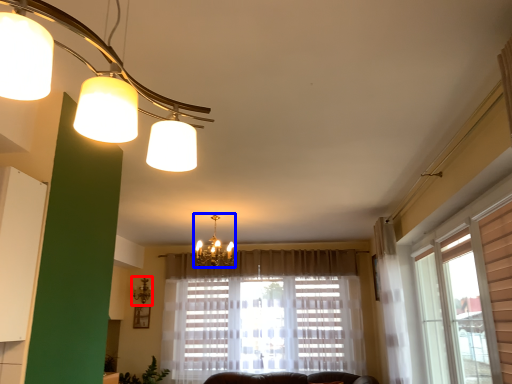
Question: Which point is further to the camera, lamp (highlighted by a red box) or lamp (highlighted by a blue box)?

Choices:
 (A) lamp
 (B) lamp

Answer: (A)